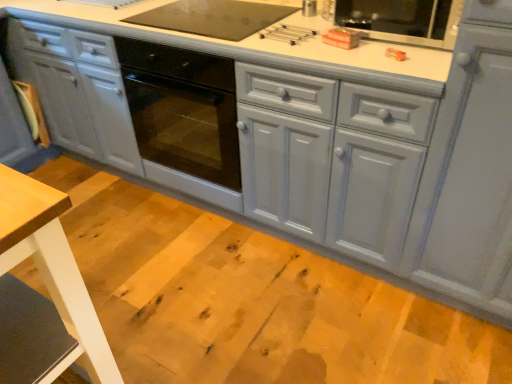
Question: From the image's perspective, is matte gray cabinet at right positioned above or below light brown wood table at lower left?

Choices:
 (A) above
 (B) below

Answer: (A)

Question: Is matte gray cabinet at right bigger or smaller than light brown wood table at lower left?

Choices:
 (A) big
 (B) small

Answer: (A)

Question: Considering their positions, is matte gray cabinet at right located in front of or behind light brown wood table at lower left?

Choices:
 (A) front
 (B) behind

Answer: (B)

Question: Would you say light brown wood table at lower left is to the left or to the right of matte gray cabinet at right in the picture?

Choices:
 (A) left
 (B) right

Answer: (A)

Question: From a real-world perspective, is light brown wood table at lower left positioned above or below matte gray cabinet at right?

Choices:
 (A) above
 (B) below

Answer: (B)

Question: Which is correct: light brown wood table at lower left is inside matte gray cabinet at right, or outside of it?

Choices:
 (A) inside
 (B) outside

Answer: (B)

Question: Is light brown wood table at lower left bigger or smaller than matte gray cabinet at right?

Choices:
 (A) small
 (B) big

Answer: (A)